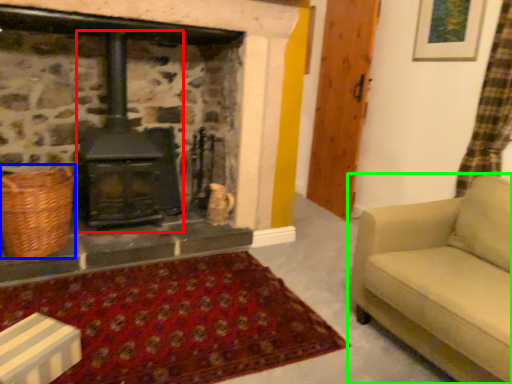
Question: Which object is positioned farthest from wood burning stove (highlighted by a red box)? Select from basket (highlighted by a blue box) and studio couch (highlighted by a green box).

Choices:
 (A) basket
 (B) studio couch

Answer: (B)